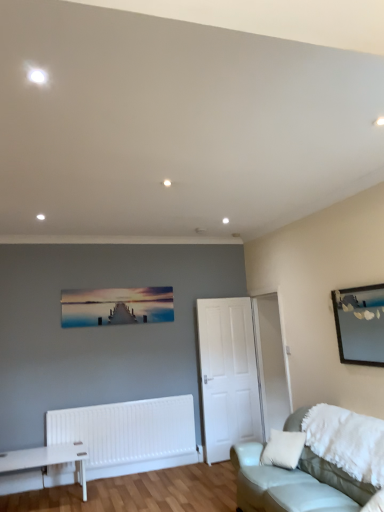
Question: Choose the correct answer: Is wooden mirror at upper right, the second picture frame from the left, inside matte wooden pier at center, the 2th picture frame from the front, or outside it?

Choices:
 (A) outside
 (B) inside

Answer: (A)

Question: Does point (347, 320) appear closer or farther from the camera than point (122, 306)?

Choices:
 (A) farther
 (B) closer

Answer: (B)

Question: Which object is the closest to the matte wooden pier at center, the 2th picture frame from the front?

Choices:
 (A) leather couch at lower right
 (B) wooden mirror at upper right, arranged as the first picture frame when viewed from the front
 (C) white matte door at center

Answer: (C)

Question: Which object is the farthest from the white matte door at center?

Choices:
 (A) wooden mirror at upper right, the first picture frame positioned from the right
 (B) leather couch at lower right
 (C) matte wooden pier at center, placed as the 1th picture frame when sorted from back to front

Answer: (A)